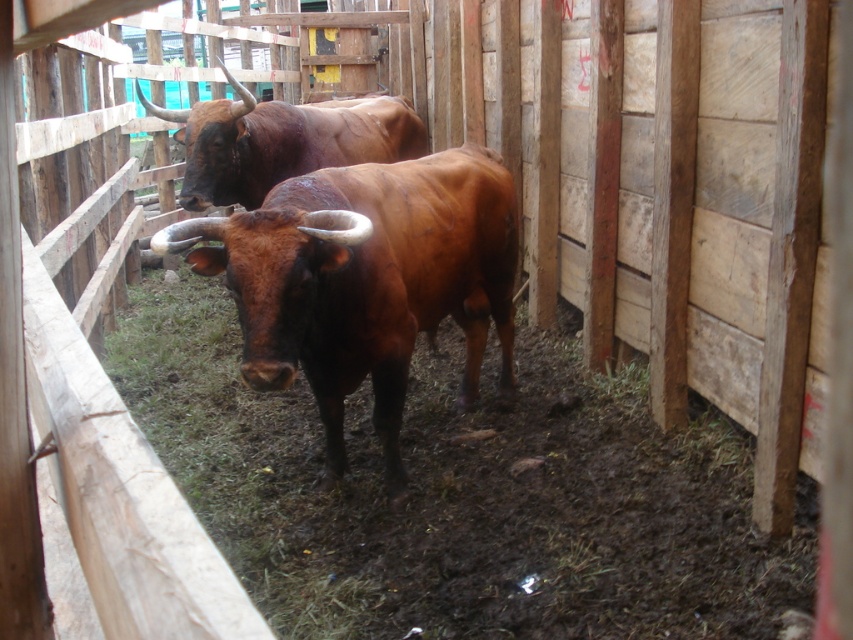
Is brown glossy bull at center to the right of brown glossy bull at upper center from the viewer's perspective?

Correct, you'll find brown glossy bull at center to the right of brown glossy bull at upper center.

Is point (453, 179) behind point (223, 120)?

No, (453, 179) is in front of (223, 120).

Find the location of a particular element. brown glossy bull at center is located at coordinates (366, 282).